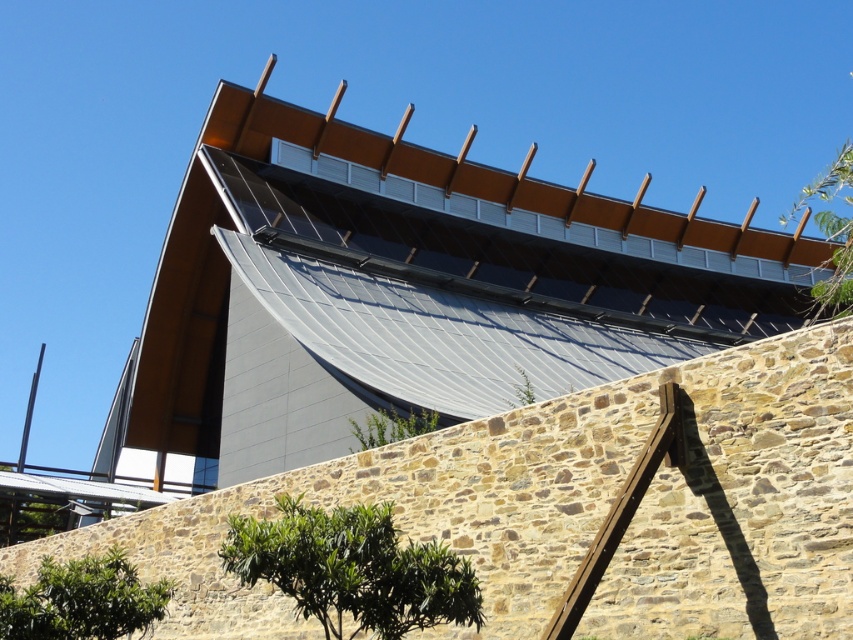
Question: Which object is positioned farthest from the green leafy tree at center?

Choices:
 (A) metallic gray roof at upper center
 (B) green leafy tree at lower left
 (C) green leafy tree at upper right

Answer: (C)

Question: Is metallic gray roof at upper center wider than green leafy tree at center?

Choices:
 (A) no
 (B) yes

Answer: (B)

Question: Which of the following is the closest to the observer?

Choices:
 (A) green leafy tree at lower center
 (B) green leafy tree at upper right
 (C) green leafy tree at center
 (D) green leafy tree at lower left

Answer: (A)

Question: Which point is closer to the camera taking this photo?

Choices:
 (A) (387, 432)
 (B) (840, 170)
 (C) (491, 262)

Answer: (A)

Question: Does green leafy tree at upper right appear on the left side of green leafy tree at center?

Choices:
 (A) no
 (B) yes

Answer: (A)

Question: Can you confirm if green leafy tree at lower left is positioned below green leafy tree at center?

Choices:
 (A) no
 (B) yes

Answer: (B)